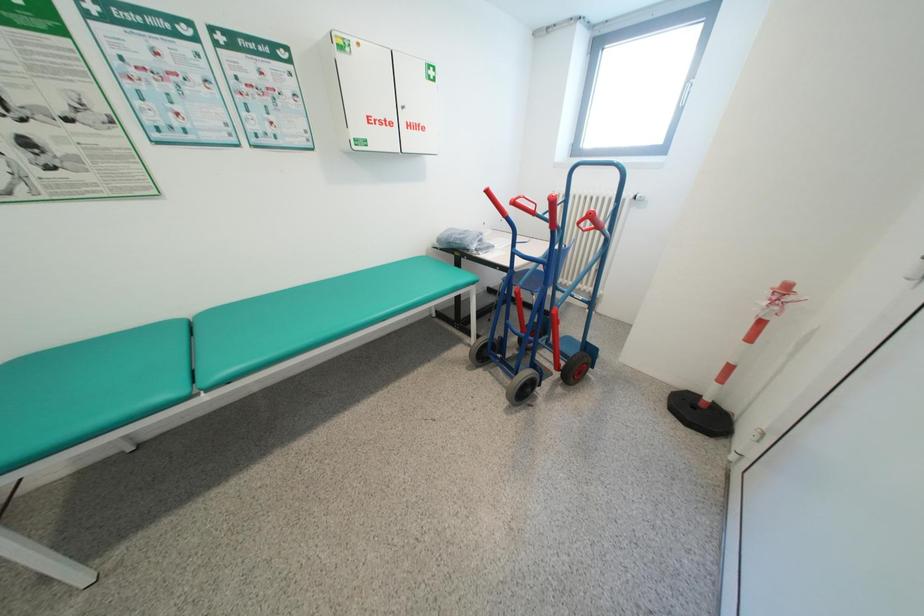
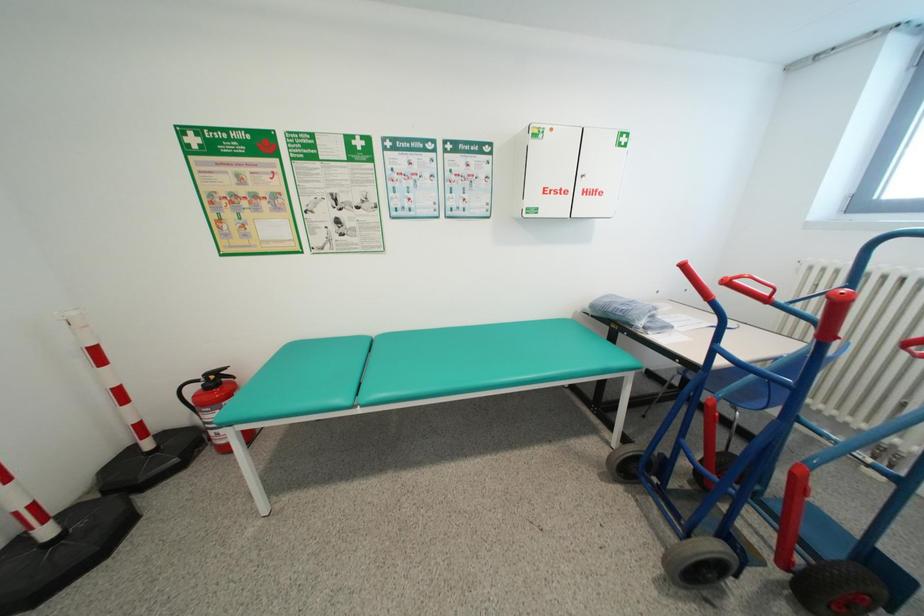
Question: The first image is from the beginning of the video and the second image is from the end. How did the camera likely rotate when shooting the video?

Choices:
 (A) Left
 (B) Right
 (C) Up
 (D) Down

Answer: (A)